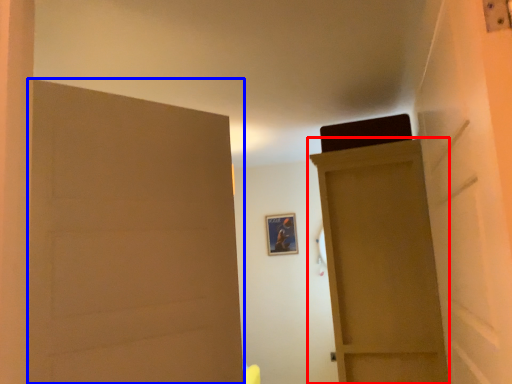
Question: Which point is further to the camera, door (highlighted by a red box) or door (highlighted by a blue box)?

Choices:
 (A) door
 (B) door

Answer: (A)